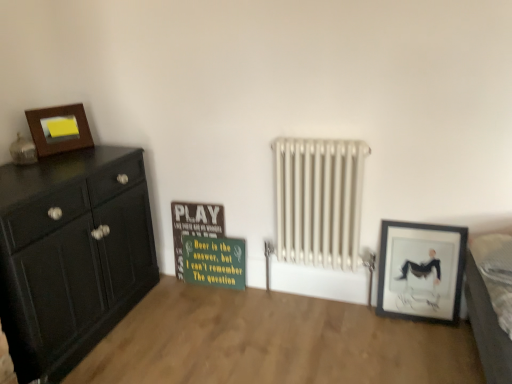
Question: Is gray fabric bed at lower right next to white metallic radiator at center and touching it?

Choices:
 (A) no
 (B) yes

Answer: (A)

Question: Is gray fabric bed at lower right aimed at white metallic radiator at center?

Choices:
 (A) yes
 (B) no

Answer: (A)

Question: Would you say gray fabric bed at lower right is outside white metallic radiator at center?

Choices:
 (A) yes
 (B) no

Answer: (A)

Question: From a real-world perspective, is gray fabric bed at lower right on white metallic radiator at center?

Choices:
 (A) yes
 (B) no

Answer: (A)

Question: Would you say gray fabric bed at lower right is a long distance from white metallic radiator at center?

Choices:
 (A) yes
 (B) no

Answer: (B)

Question: In terms of width, does white metallic radiator at center look wider or thinner when compared to matte black picture frame at lower right, which ranks as the first picture frame in right-to-left order?

Choices:
 (A) thin
 (B) wide

Answer: (B)

Question: From the image's perspective, is white metallic radiator at center located above or below matte black picture frame at lower right, the 1th picture frame when ordered from bottom to top?

Choices:
 (A) above
 (B) below

Answer: (A)

Question: Looking at the image, does white metallic radiator at center seem bigger or smaller compared to matte black picture frame at lower right, which ranks as the 2th picture frame in left-to-right order?

Choices:
 (A) big
 (B) small

Answer: (A)

Question: Considering their positions, is white metallic radiator at center located in front of or behind matte black picture frame at lower right, which ranks as the 2th picture frame in left-to-right order?

Choices:
 (A) behind
 (B) front

Answer: (B)

Question: Do you think white metallic radiator at center is within matte wooden picture frame at upper left, which is the first picture frame in left-to-right order, or outside of it?

Choices:
 (A) outside
 (B) inside

Answer: (A)

Question: Is white metallic radiator at center wider or thinner than matte wooden picture frame at upper left, placed as the first picture frame when sorted from top to bottom?

Choices:
 (A) thin
 (B) wide

Answer: (B)

Question: Is point (314, 226) closer or farther from the camera than point (82, 115)?

Choices:
 (A) closer
 (B) farther

Answer: (A)

Question: From a real-world perspective, is white metallic radiator at center positioned above or below matte wooden picture frame at upper left, which is the first picture frame in left-to-right order?

Choices:
 (A) below
 (B) above

Answer: (A)

Question: In the image, is matte black picture frame at lower right, the 1th picture frame when ordered from bottom to top, on the left side or the right side of gray fabric bed at lower right?

Choices:
 (A) left
 (B) right

Answer: (A)

Question: From the image's perspective, is matte black picture frame at lower right, which is counted as the 2th picture frame, starting from the top, above or below gray fabric bed at lower right?

Choices:
 (A) above
 (B) below

Answer: (B)